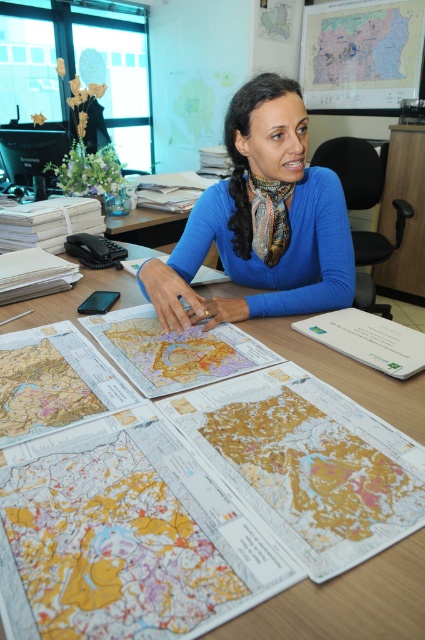
Where is the blue silk scarf at center located in terms of coordinates?

The blue silk scarf at center is located at coordinates point (260, 220).

You are an office assistant who needs to place a new document on the desk. The desk has limited space between the blue silk scarf at center and the paper maps at center. What is the minimum width of the desk required to accommodate both items without overlapping?

The blue silk scarf at center and the paper maps at center are 8.87 inches apart. Therefore, the desk must be at least 8.87 inches wide to fit both items without overlapping.